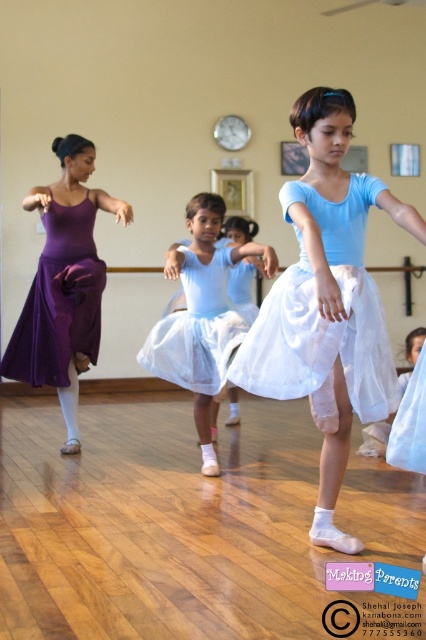
Locate an element on the screen. light blue satin ballet skirt at center is located at coordinates (327, 301).

Which of these two, light blue satin ballet skirt at center or white satin ballet skirt at center, stands taller?

Standing taller between the two is light blue satin ballet skirt at center.

This screenshot has width=426, height=640. In order to click on light blue satin ballet skirt at center in this screenshot , I will do `click(327, 301)`.

What do you see at coordinates (319, 342) in the screenshot?
I see `white satin ballet skirt at center` at bounding box center [319, 342].

From the picture: Between white satin ballet skirt at center and purple satin skirt at left, which one appears on the right side from the viewer's perspective?

Positioned to the right is white satin ballet skirt at center.

Describe the element at coordinates (319, 342) in the screenshot. I see `white satin ballet skirt at center` at that location.

What are the coordinates of `white satin ballet skirt at center` in the screenshot? It's located at click(x=319, y=342).

Can you confirm if light blue satin ballet skirt at center is thinner than white satin skirt at center?

No.

Is point (319, 180) positioned after point (207, 275)?

That is False.

This screenshot has width=426, height=640. In order to click on light blue satin ballet skirt at center in this screenshot , I will do `click(327, 301)`.